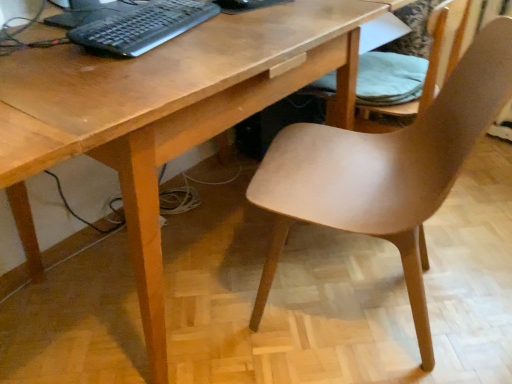
At what (x,y) coordinates should I click in order to perform the action: click on vacant space to the left of black plastic keyboard at upper left. Please return your answer as a coordinate pair (x, y). The width and height of the screenshot is (512, 384). Looking at the image, I should click on (35, 35).